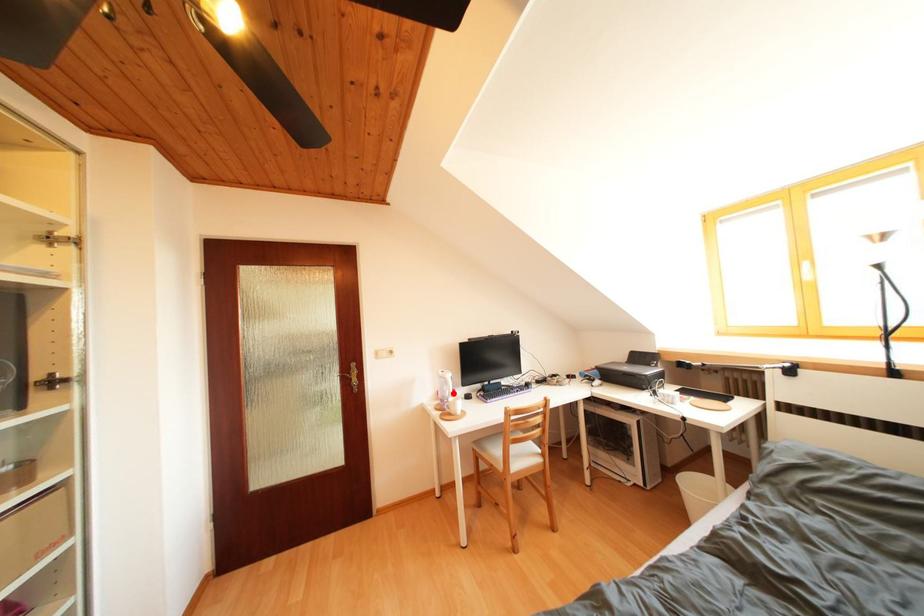
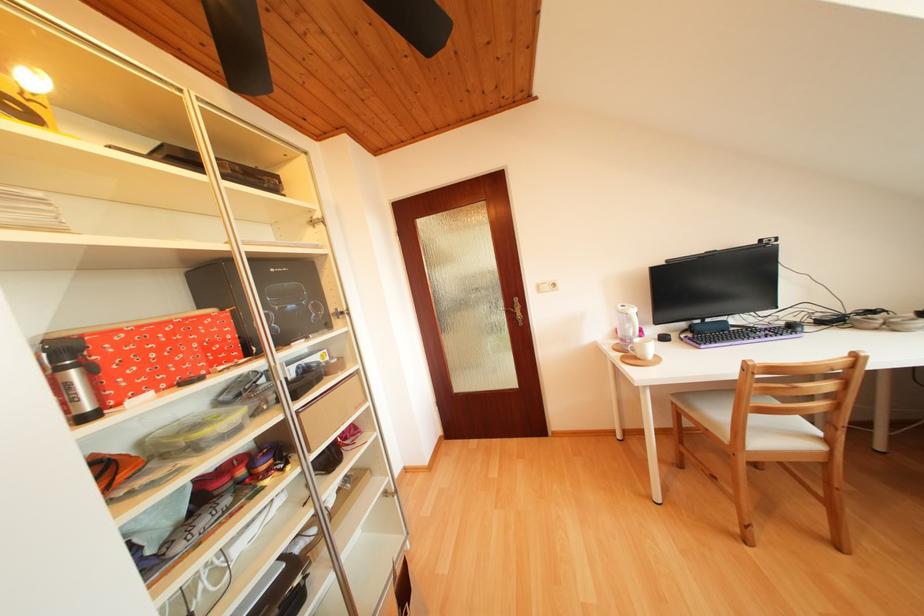
The point at the highlighted location is marked in the first image. Where is the corresponding point in the second image?

(636, 331)